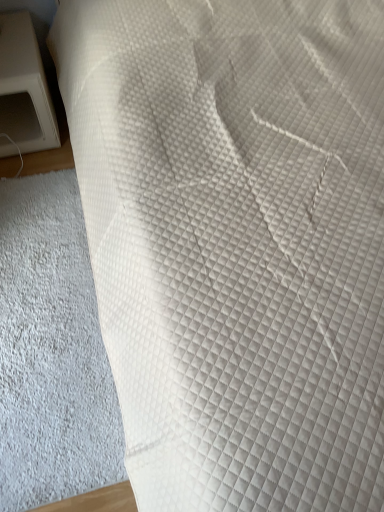
Question: Considering the positions of white plastic microwave at left and white quilted fabric at lower left in the image, is white plastic microwave at left wider or thinner than white quilted fabric at lower left?

Choices:
 (A) thin
 (B) wide

Answer: (A)

Question: Based on their sizes in the image, would you say white plastic microwave at left is bigger or smaller than white quilted fabric at lower left?

Choices:
 (A) big
 (B) small

Answer: (A)

Question: From the image's perspective, relative to white quilted fabric at lower left, is white plastic microwave at left above or below?

Choices:
 (A) above
 (B) below

Answer: (A)

Question: Would you say white quilted fabric at lower left is inside or outside white plastic microwave at left?

Choices:
 (A) inside
 (B) outside

Answer: (B)

Question: From a real-world perspective, is white quilted fabric at lower left above or below white plastic microwave at left?

Choices:
 (A) above
 (B) below

Answer: (B)

Question: Is point (0, 273) positioned closer to the camera than point (16, 87)?

Choices:
 (A) closer
 (B) farther

Answer: (A)

Question: Considering the relative positions of white quilted fabric at lower left and white plastic microwave at left in the image provided, is white quilted fabric at lower left to the left or to the right of white plastic microwave at left?

Choices:
 (A) left
 (B) right

Answer: (B)